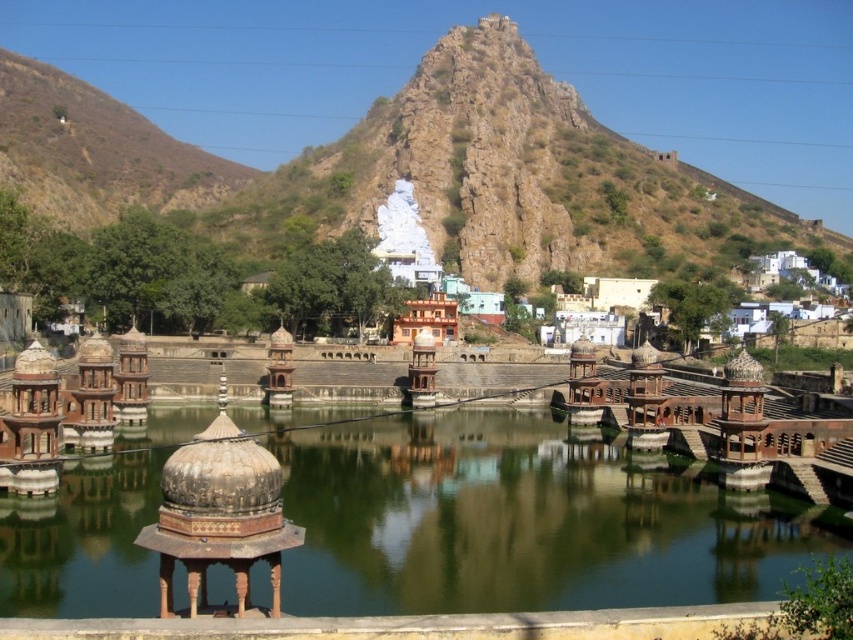
Question: Which point is closer to the camera taking this photo?

Choices:
 (A) (566, 227)
 (B) (459, 566)

Answer: (B)

Question: In this image, where is rustic stone mountain at upper center located relative to greenish water at center?

Choices:
 (A) above
 (B) below

Answer: (A)

Question: Does rustic stone mountain at upper center come in front of greenish water at center?

Choices:
 (A) yes
 (B) no

Answer: (B)

Question: Which point appears closest to the camera in this image?

Choices:
 (A) (466, 248)
 (B) (663, 588)

Answer: (B)

Question: Does rustic stone mountain at upper center lie in front of greenish water at center?

Choices:
 (A) no
 (B) yes

Answer: (A)